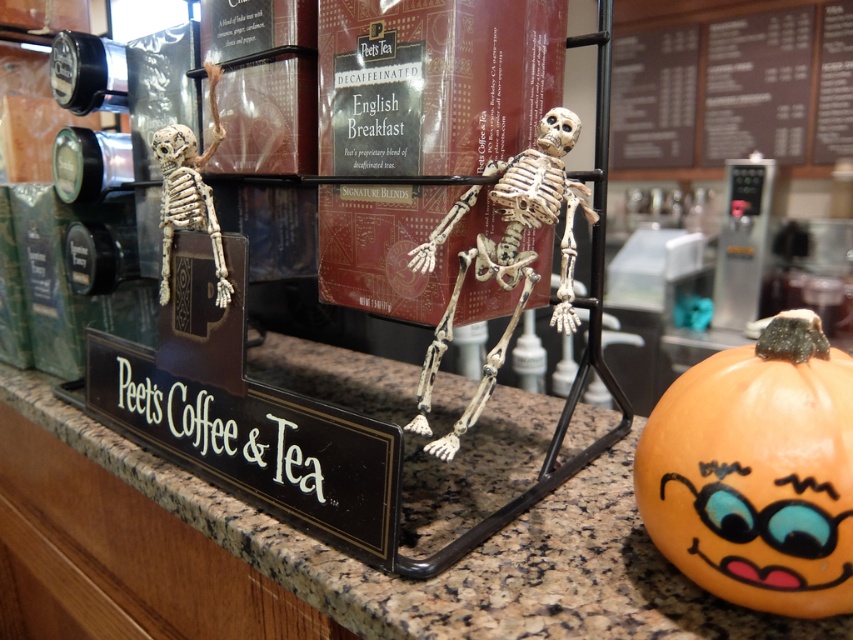
Who is more distant from viewer, (457, 202) or (189, 172)?

Positioned behind is point (189, 172).

Does bone-like skeleton at center appear under white matte skeleton at left?

Yes, bone-like skeleton at center is below white matte skeleton at left.

Which is in front, point (509, 189) or point (165, 164)?

Point (509, 189) is in front.

The height and width of the screenshot is (640, 853). I want to click on bone-like skeleton at center, so click(512, 259).

Does orange painted pumpkin at lower right have a greater height compared to white matte skeleton at left?

No, orange painted pumpkin at lower right is not taller than white matte skeleton at left.

From the picture: Does orange painted pumpkin at lower right appear under white matte skeleton at left?

Correct, orange painted pumpkin at lower right is located below white matte skeleton at left.

Where is `orange painted pumpkin at lower right`? The width and height of the screenshot is (853, 640). orange painted pumpkin at lower right is located at coordinates (757, 472).

Identify the location of orange painted pumpkin at lower right. Image resolution: width=853 pixels, height=640 pixels. (757, 472).

Is granite countertop at center taller than bone-like skeleton at center?

No.

Is granite countertop at center smaller than bone-like skeleton at center?

Actually, granite countertop at center might be larger than bone-like skeleton at center.

In order to click on granite countertop at center in this screenshot , I will do `click(459, 561)`.